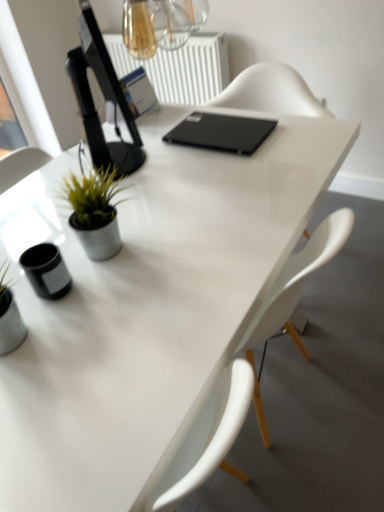
Question: From the image's perspective, is green matte plant at left over black glossy computer monitor at upper left?

Choices:
 (A) yes
 (B) no

Answer: (B)

Question: Is green matte plant at left not inside black glossy computer monitor at upper left?

Choices:
 (A) no
 (B) yes

Answer: (B)

Question: Does green matte plant at left have a smaller size compared to black glossy computer monitor at upper left?

Choices:
 (A) no
 (B) yes

Answer: (B)

Question: From a real-world perspective, is green matte plant at left on top of black glossy computer monitor at upper left?

Choices:
 (A) no
 (B) yes

Answer: (A)

Question: Is green matte plant at left to the right of black glossy computer monitor at upper left from the viewer's perspective?

Choices:
 (A) no
 (B) yes

Answer: (B)

Question: Does green matte plant at left appear on the left side of black glossy computer monitor at upper left?

Choices:
 (A) no
 (B) yes

Answer: (A)

Question: Is black glossy computer monitor at upper left inside black matte laptop at center?

Choices:
 (A) no
 (B) yes

Answer: (A)

Question: Does black matte laptop at center have a smaller size compared to black glossy computer monitor at upper left?

Choices:
 (A) no
 (B) yes

Answer: (B)

Question: Can you confirm if black matte laptop at center is bigger than black glossy computer monitor at upper left?

Choices:
 (A) yes
 (B) no

Answer: (B)

Question: Does black matte laptop at center have a lesser width compared to black glossy computer monitor at upper left?

Choices:
 (A) no
 (B) yes

Answer: (A)

Question: Considering the relative positions of black matte laptop at center and black glossy computer monitor at upper left in the image provided, is black matte laptop at center to the right of black glossy computer monitor at upper left from the viewer's perspective?

Choices:
 (A) yes
 (B) no

Answer: (A)

Question: Is black matte laptop at center positioned beyond the bounds of black glossy computer monitor at upper left?

Choices:
 (A) no
 (B) yes

Answer: (B)

Question: Is black glossy computer monitor at upper left oriented away from white plastic radiator at upper center?

Choices:
 (A) yes
 (B) no

Answer: (B)